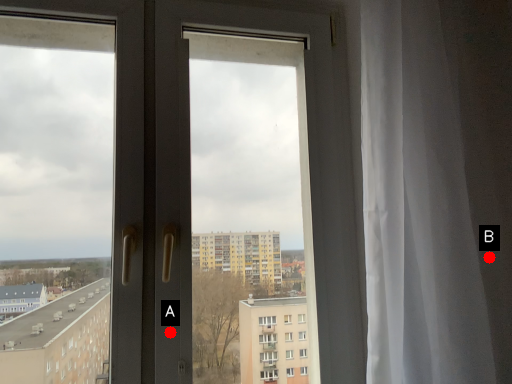
Question: Two points are circled on the image, labeled by A and B beside each circle. Which of the following is the closest to the observer?

Choices:
 (A) A is closer
 (B) B is closer

Answer: (B)